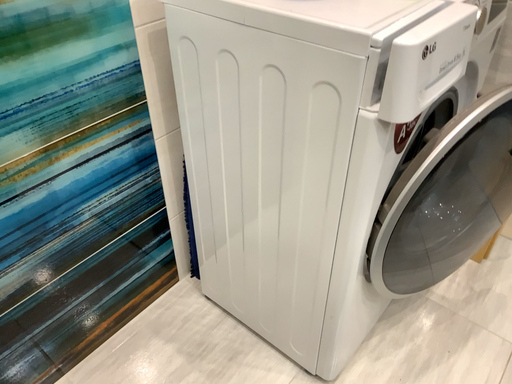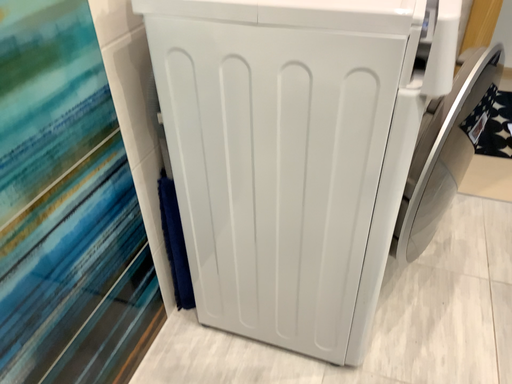
Question: Which way did the camera rotate in the video?

Choices:
 (A) rotated right
 (B) rotated left

Answer: (A)